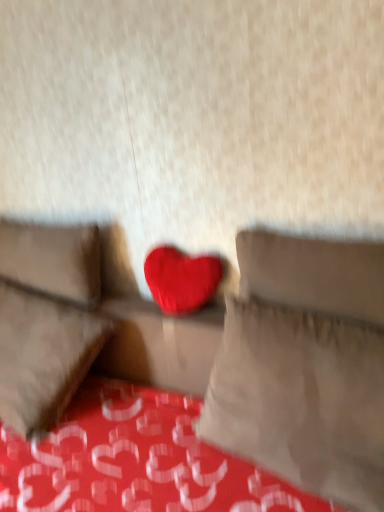
Find the location of a particular element. The image size is (384, 512). matte red heart at center is located at coordinates (181, 279).

From the image's perspective, is suede-like beige pillow at left, which appears as the 2th pillow when viewed from the front, below matte red heart at center?

Incorrect, from the image's perspective, suede-like beige pillow at left, which appears as the 2th pillow when viewed from the front, is higher than matte red heart at center.

Is suede-like beige pillow at left, arranged as the 2th pillow when viewed from the right, facing away from matte red heart at center?

No.

Who is taller, suede-like beige pillow at left, which appears as the 2th pillow when viewed from the front, or matte red heart at center?

With more height is suede-like beige pillow at left, which appears as the 2th pillow when viewed from the front.

Is point (50, 264) closer to viewer compared to point (186, 266)?

No, (50, 264) is further to viewer.

From the image's perspective, is matte red heart at center positioned above or below matte fabric couch at center?

matte red heart at center is above matte fabric couch at center.

Is matte red heart at center thinner than matte fabric couch at center?

Indeed, matte red heart at center has a lesser width compared to matte fabric couch at center.

Is point (175, 263) closer or farther from the camera than point (60, 325)?

Point (175, 263) is positioned closer to the camera compared to point (60, 325).

Does point (313, 455) come in front of point (99, 281)?

Yes, point (313, 455) is closer to viewer.

Does matte fabric heart at center, which is the first pillow from front to back, come behind suede-like beige pillow at left, arranged as the 2th pillow when viewed from the right?

No, matte fabric heart at center, which is the first pillow from front to back, is in front of suede-like beige pillow at left, arranged as the 2th pillow when viewed from the right.

The height and width of the screenshot is (512, 384). What are the coordinates of `pillow below the suede-like beige pillow at left, which appears as the 2th pillow when viewed from the front (from the image's perspective)` in the screenshot? It's located at (301, 399).

How different are the orientations of matte fabric heart at center, which is the second pillow in back-to-front order, and suede-like beige pillow at left, which appears as the 1th pillow when viewed from the back, in degrees?

They differ by 0.479 degrees in their facing directions.

Is matte fabric heart at center, which appears as the 1th pillow when viewed from the right, closer to camera compared to matte fabric couch at center?

No, it is not.

How far apart are matte fabric heart at center, which appears as the 1th pillow when viewed from the right, and matte fabric couch at center?

They are 12.80 centimeters apart.

Is matte fabric heart at center, placed as the second pillow when sorted from left to right, not inside matte fabric couch at center?

No, most part of matte fabric heart at center, placed as the second pillow when sorted from left to right, lies within matte fabric couch at center.

In terms of height, does matte fabric heart at center, which is the first pillow from front to back, look taller or shorter compared to matte fabric couch at center?

In the image, matte fabric heart at center, which is the first pillow from front to back, appears to be taller than matte fabric couch at center.

From a real-world perspective, which pillow is the 2nd one above the matte fabric couch at center? Please provide its 2D coordinates.

[(52, 260)]

How different are the orientations of matte fabric couch at center and suede-like beige pillow at left, which appears as the 1th pillow when viewed from the back, in degrees?

There is a 0.893-degree angle between the facing directions of matte fabric couch at center and suede-like beige pillow at left, which appears as the 1th pillow when viewed from the back.

Is matte fabric couch at center completely or partially outside of suede-like beige pillow at left, arranged as the 2th pillow when viewed from the right?

That's correct, matte fabric couch at center is outside of suede-like beige pillow at left, arranged as the 2th pillow when viewed from the right.

Does matte fabric couch at center have a lesser width compared to suede-like beige pillow at left, which appears as the 2th pillow when viewed from the front?

In fact, matte fabric couch at center might be wider than suede-like beige pillow at left, which appears as the 2th pillow when viewed from the front.

Which point is more distant from viewer, (270, 414) or (176, 305)?

The point (176, 305) is behind.

Is matte fabric heart at center, which is the second pillow in back-to-front order, far from matte red heart at center?

matte fabric heart at center, which is the second pillow in back-to-front order, is actually quite close to matte red heart at center.

How different are the orientations of matte fabric heart at center, placed as the second pillow when sorted from left to right, and matte red heart at center in degrees?

matte fabric heart at center, placed as the second pillow when sorted from left to right, and matte red heart at center are facing 2.71 degrees away from each other.

Measure the distance from matte fabric heart at center, placed as the second pillow when sorted from left to right, to matte red heart at center.

The distance of matte fabric heart at center, placed as the second pillow when sorted from left to right, from matte red heart at center is 16.63 inches.

Could you tell me if matte red heart at center is facing matte fabric heart at center, which appears as the 1th pillow when viewed from the right?

→ No, matte red heart at center is not aimed at matte fabric heart at center, which appears as the 1th pillow when viewed from the right.

Who is taller, matte red heart at center or matte fabric heart at center, placed as the second pillow when sorted from left to right?

matte fabric heart at center, placed as the second pillow when sorted from left to right.

Consider the image. Is matte red heart at center beside matte fabric heart at center, which is the second pillow in back-to-front order?

No, matte red heart at center is not touching matte fabric heart at center, which is the second pillow in back-to-front order.

From a real-world perspective, is matte red heart at center under matte fabric heart at center, which is the first pillow from front to back?

Incorrect, from a real-world perspective, matte red heart at center is higher than matte fabric heart at center, which is the first pillow from front to back.

Find the location of a particular element. The height and width of the screenshot is (512, 384). heart that appears on the right of suede-like beige pillow at left, arranged as the 2th pillow when viewed from the right is located at coordinates (181, 279).

Where is `heart that appears above the matte fabric couch at center (from the image's perspective)`? The width and height of the screenshot is (384, 512). heart that appears above the matte fabric couch at center (from the image's perspective) is located at coordinates (181, 279).

Looking at the image, which one is located closer to suede-like beige pillow at left, which appears as the 1th pillow when viewed from the back, matte red heart at center or matte fabric couch at center?

Among the two, matte fabric couch at center is located nearer to suede-like beige pillow at left, which appears as the 1th pillow when viewed from the back.

Estimate the real-world distances between objects in this image. Which object is closer to matte red heart at center, suede-like beige pillow at left, which appears as the 1th pillow when viewed from the back, or matte fabric couch at center?

The object closer to matte red heart at center is matte fabric couch at center.

Which object lies nearer to the anchor point matte fabric couch at center, matte fabric heart at center, placed as the second pillow when sorted from left to right, or matte red heart at center?

matte fabric heart at center, placed as the second pillow when sorted from left to right, is closer to matte fabric couch at center.

Estimate the real-world distances between objects in this image. Which object is closer to matte fabric couch at center, matte red heart at center or suede-like beige pillow at left, arranged as the 2th pillow when viewed from the right?

Among the two, matte red heart at center is located nearer to matte fabric couch at center.

Estimate the real-world distances between objects in this image. Which object is further from matte fabric heart at center, which is the first pillow from front to back, matte fabric couch at center or matte red heart at center?

Among the two, matte red heart at center is located further to matte fabric heart at center, which is the first pillow from front to back.

Looking at the image, which one is located further to matte fabric couch at center, suede-like beige pillow at left, which appears as the 1th pillow when viewed from the back, or matte red heart at center?

suede-like beige pillow at left, which appears as the 1th pillow when viewed from the back, is positioned further to the anchor matte fabric couch at center.

From the image, which object appears to be farther from matte fabric couch at center, matte fabric heart at center, which is the first pillow from front to back, or suede-like beige pillow at left, which appears as the 2th pillow when viewed from the front?

suede-like beige pillow at left, which appears as the 2th pillow when viewed from the front, lies further to matte fabric couch at center than the other object.

Looking at the image, which one is located further to matte red heart at center, matte fabric couch at center or matte fabric heart at center, which appears as the 1th pillow when viewed from the right?

matte fabric heart at center, which appears as the 1th pillow when viewed from the right, is positioned further to the anchor matte red heart at center.

Where is `heart between suede-like beige pillow at left, which appears as the 2th pillow when viewed from the front, and matte fabric heart at center, which appears as the 1th pillow when viewed from the right`? This screenshot has height=512, width=384. heart between suede-like beige pillow at left, which appears as the 2th pillow when viewed from the front, and matte fabric heart at center, which appears as the 1th pillow when viewed from the right is located at coordinates (181, 279).

You are a GUI agent. You are given a task and a screenshot of the screen. Output one action in this format:
    pyautogui.click(x=<x>, y=<y>)
    Task: Click on the heart between matte fabric couch at center and suede-like beige pillow at left, which appears as the 2th pillow when viewed from the front, along the z-axis
    Image resolution: width=384 pixels, height=512 pixels.
    Given the screenshot: What is the action you would take?
    pyautogui.click(x=181, y=279)

Where is `pillow located between matte fabric couch at center and suede-like beige pillow at left, which appears as the 2th pillow when viewed from the front, in the depth direction`? The height and width of the screenshot is (512, 384). pillow located between matte fabric couch at center and suede-like beige pillow at left, which appears as the 2th pillow when viewed from the front, in the depth direction is located at coordinates (301, 399).

Find the location of `pillow between matte fabric couch at center and matte red heart at center from front to back`. pillow between matte fabric couch at center and matte red heart at center from front to back is located at coordinates (301, 399).